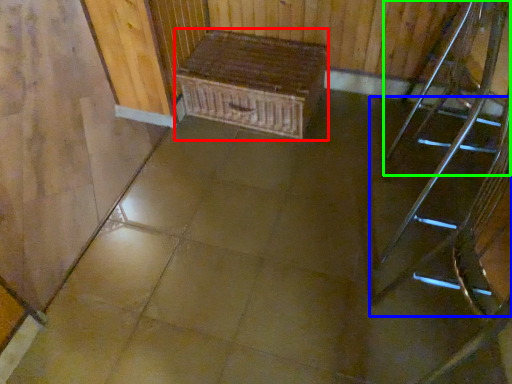
Question: Which object is positioned farthest from furniture (highlighted by a red box)? Select from stairs (highlighted by a blue box) and chair (highlighted by a green box).

Choices:
 (A) stairs
 (B) chair

Answer: (A)